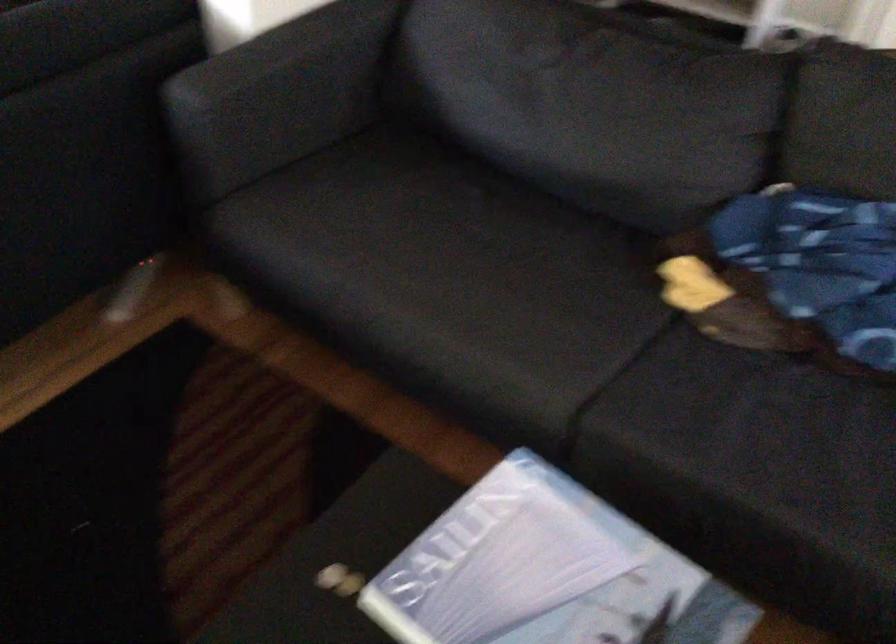
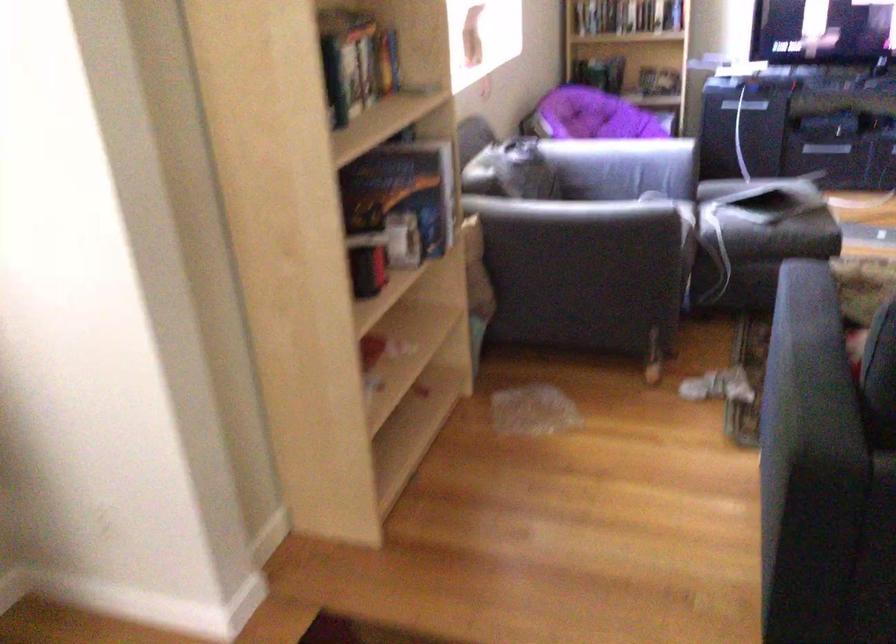
Question: The camera is either moving clockwise (left) or counter-clockwise (right) around the object. The first image is from the beginning of the video and the second image is from the end. Is the camera moving left or right when shooting the video?

Choices:
 (A) Left
 (B) Right

Answer: (B)